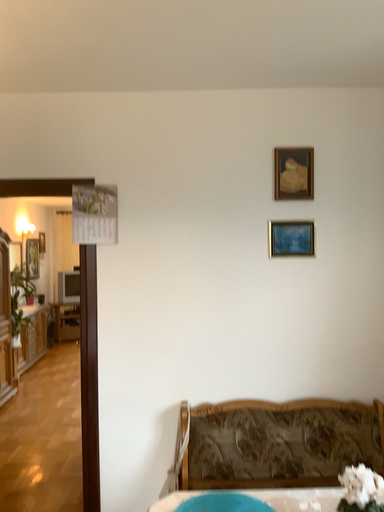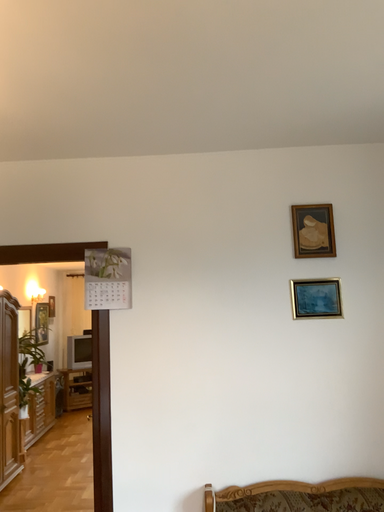
Question: How did the camera likely rotate when shooting the video?

Choices:
 (A) rotated upward
 (B) rotated downward

Answer: (A)